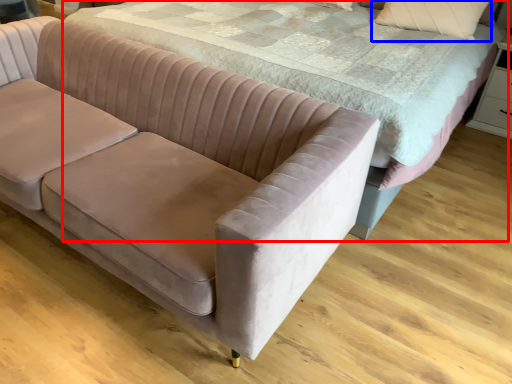
Question: Among these objects, which one is farthest to the camera, bed (highlighted by a red box) or pillow (highlighted by a blue box)?

Choices:
 (A) bed
 (B) pillow

Answer: (B)